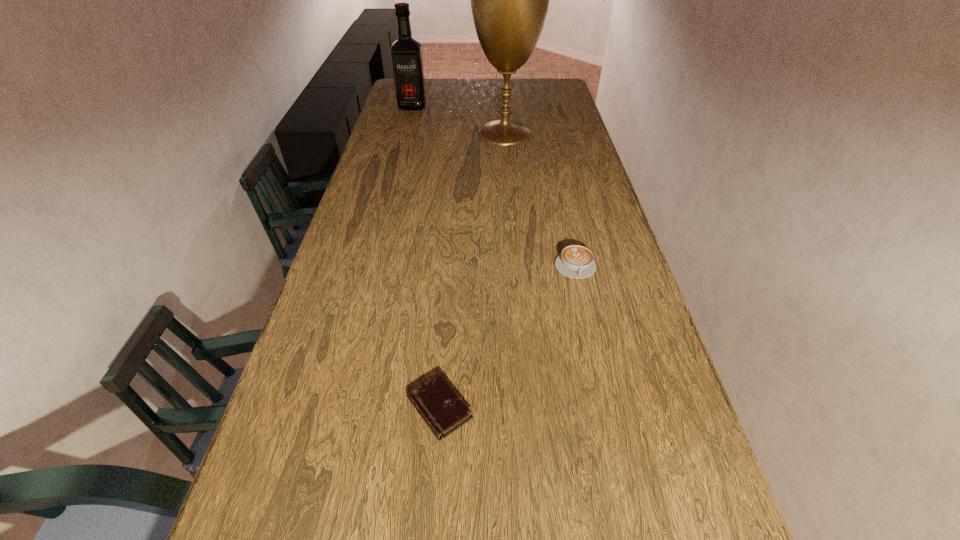
This screenshot has height=540, width=960. I want to click on vacant space located on the side of the cappuccino with the handle, so click(587, 315).

Identify the location of vacant space located 0.120m on the right of the diary. [531, 408].

This screenshot has height=540, width=960. In order to click on object that is at the left edge in this screenshot , I will do `click(406, 53)`.

Locate an element on the screen. Image resolution: width=960 pixels, height=540 pixels. object present at the right edge is located at coordinates (575, 261).

Find the location of a particular element. This screenshot has height=540, width=960. vacant space at the left edge is located at coordinates (355, 289).

Find the location of `vacant space at the right edge`. vacant space at the right edge is located at coordinates (583, 213).

Locate an element on the screen. The image size is (960, 540). free space at the far right corner of the desktop is located at coordinates (564, 97).

Where is `free area in between the farthest object and the diary`? The width and height of the screenshot is (960, 540). free area in between the farthest object and the diary is located at coordinates (426, 258).

Where is `vacant area between the liquor and the diary`? The height and width of the screenshot is (540, 960). vacant area between the liquor and the diary is located at coordinates (426, 258).

Find the location of a particular element. The width and height of the screenshot is (960, 540). empty space between the liquor and the nearest object is located at coordinates (426, 258).